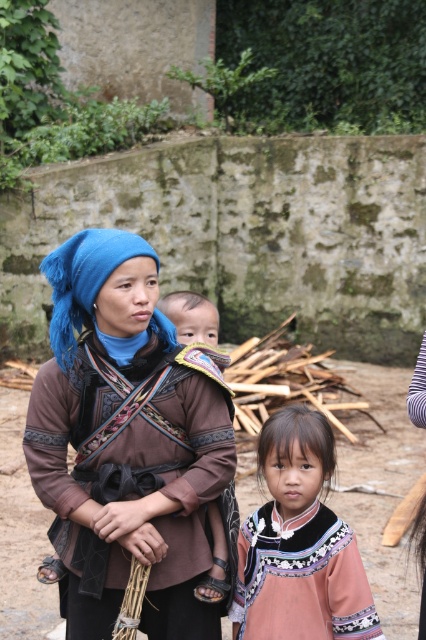
Question: Is matte brown fabric at center thinner than brown fabric baby at center?

Choices:
 (A) yes
 (B) no

Answer: (B)

Question: In this image, where is pink fabric dress at center located relative to blue fabric headdress at center?

Choices:
 (A) left
 (B) right

Answer: (B)

Question: Among these objects, which one is nearest to the camera?

Choices:
 (A) blue fabric headdress at center
 (B) pink fabric dress at center
 (C) brown fabric baby at center

Answer: (A)

Question: Can you confirm if pink fabric dress at center is positioned below blue fabric headdress at center?

Choices:
 (A) yes
 (B) no

Answer: (A)

Question: Which is farther from the pink fabric dress at center?

Choices:
 (A) blue fabric headdress at center
 (B) matte brown fabric at center
 (C) brown fabric baby at center

Answer: (A)

Question: Which of the following is the closest to the observer?

Choices:
 (A) (198, 582)
 (B) (63, 289)
 (C) (362, 609)
 (D) (94, 448)

Answer: (C)